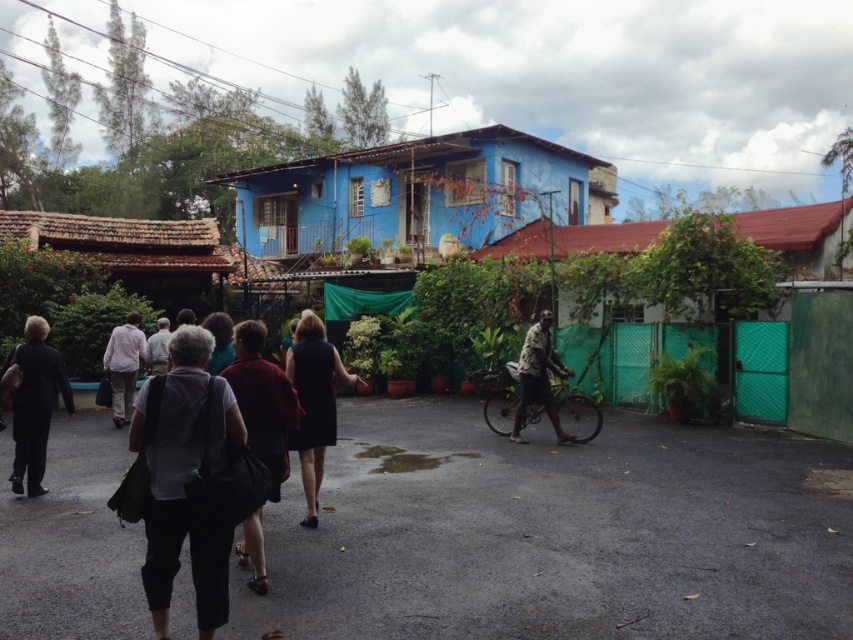
You are standing at the point with coordinates point (186,314) and want to walk towards the blue building with a red roof. Is the point point (186,529) located in front of you or behind you?

Point (186,529) is in front of point (186,314), so if you are facing the blue building with a red roof, the point (186,529) is located in front of you.

You are a delivery person trying to decide whether to place a new package in the dark gray fabric bag at center or the dark brown textured shirt at center. Based on their sizes, which one can hold the package better?

The dark brown textured shirt at center occupies more space than the dark gray fabric bag at center, so the dark brown textured shirt at center can hold the package better.